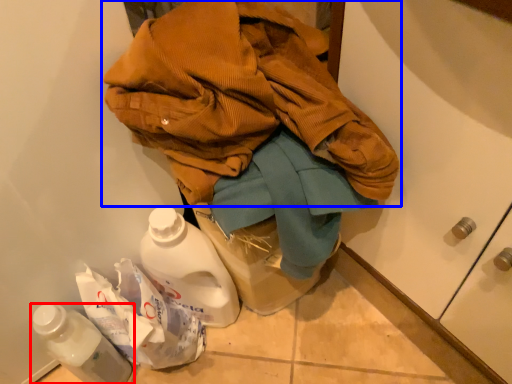
Question: Which point is closer to the camera, bottle (highlighted by a red box) or jacket (highlighted by a blue box)?

Choices:
 (A) bottle
 (B) jacket

Answer: (B)